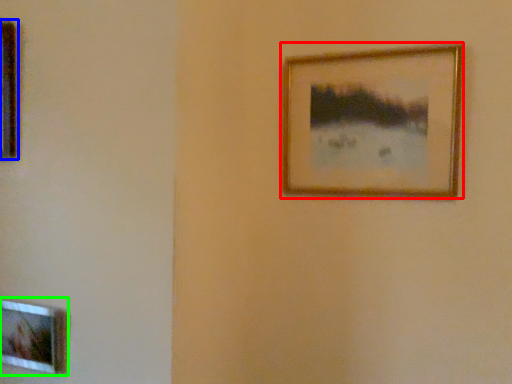
Question: Considering the real-world distances, which object is closest to picture frame (highlighted by a red box)? picture frame (highlighted by a blue box) or picture frame (highlighted by a green box).

Choices:
 (A) picture frame
 (B) picture frame

Answer: (A)